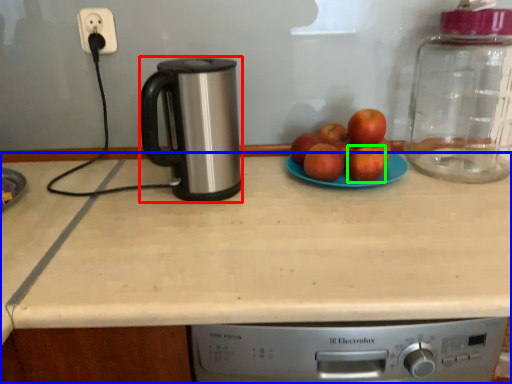
Question: Which object is the farthest from kitchen appliance (highlighted by a red box)? Choose among these: countertop (highlighted by a blue box) or apple (highlighted by a green box).

Choices:
 (A) countertop
 (B) apple

Answer: (B)